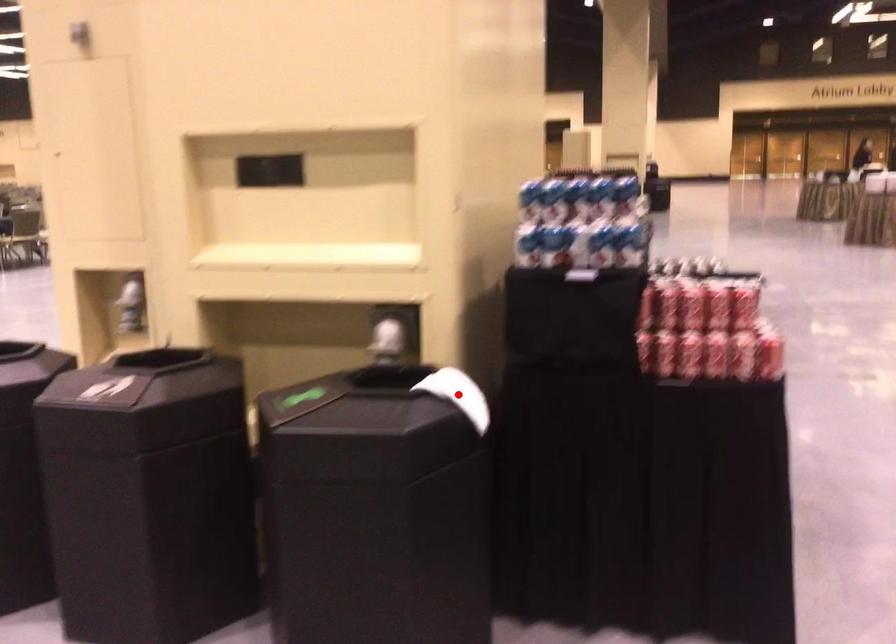
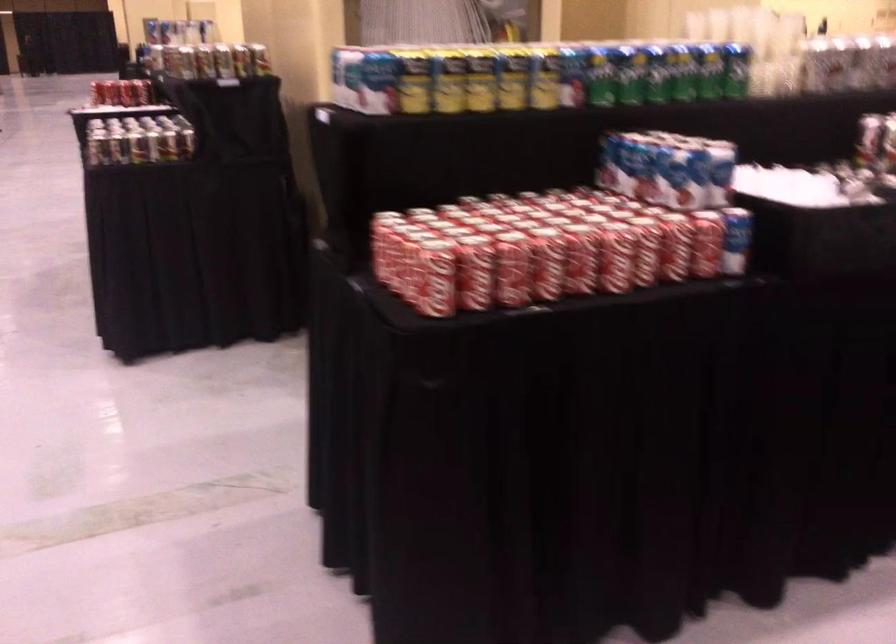
Question: I am providing you with two images of the same scene from different viewpoints. A red point is marked on the first image. Is the red point's position out of view in image 2?

Choices:
 (A) Yes
 (B) No

Answer: (A)